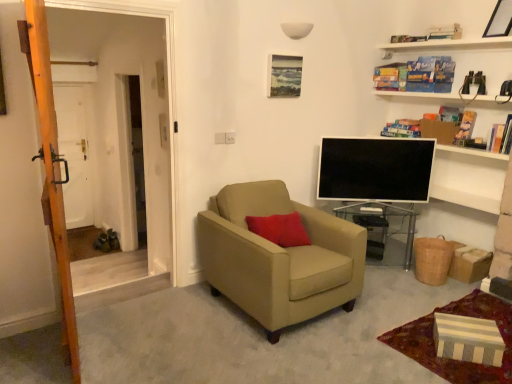
Question: From the image's perspective, is wooden picture frame at upper right, arranged as the second picture frame when ordered from the bottom, on top of wooden ladder at left?

Choices:
 (A) yes
 (B) no

Answer: (A)

Question: Is wooden picture frame at upper right, acting as the 1th picture frame starting from the top, to the right of wooden ladder at left from the viewer's perspective?

Choices:
 (A) no
 (B) yes

Answer: (B)

Question: Is wooden picture frame at upper right, marked as the 1th picture frame in a right-to-left arrangement, next to wooden ladder at left and touching it?

Choices:
 (A) no
 (B) yes

Answer: (A)

Question: From a real-world perspective, is wooden picture frame at upper right, acting as the second picture frame starting from the back, located higher than wooden ladder at left?

Choices:
 (A) no
 (B) yes

Answer: (B)

Question: Is wooden picture frame at upper right, marked as the 1th picture frame in a right-to-left arrangement, further to camera compared to wooden ladder at left?

Choices:
 (A) yes
 (B) no

Answer: (A)

Question: Is hardcover book at upper right, the first book from the bottom, inside the boundaries of transparent glass table at center, or outside?

Choices:
 (A) inside
 (B) outside

Answer: (B)

Question: Considering their positions, is hardcover book at upper right, the first book from the bottom, located in front of or behind transparent glass table at center?

Choices:
 (A) front
 (B) behind

Answer: (A)

Question: Considering the relative positions of hardcover book at upper right, the first book from the bottom, and transparent glass table at center in the image provided, is hardcover book at upper right, the first book from the bottom, to the left or to the right of transparent glass table at center?

Choices:
 (A) left
 (B) right

Answer: (B)

Question: Does point (488, 144) appear closer or farther from the camera than point (385, 206)?

Choices:
 (A) closer
 (B) farther

Answer: (A)

Question: Considering the positions of white matte door at left and hardcover book at upper right, the 3th book positioned from the bottom, in the image, is white matte door at left bigger or smaller than hardcover book at upper right, the 3th book positioned from the bottom,?

Choices:
 (A) small
 (B) big

Answer: (B)

Question: Would you say white matte door at left is to the left or to the right of hardcover book at upper right, the 3th book positioned from the bottom, in the picture?

Choices:
 (A) right
 (B) left

Answer: (B)

Question: Is white matte door at left wider or thinner than hardcover book at upper right, the 3th book positioned from the bottom?

Choices:
 (A) wide
 (B) thin

Answer: (A)

Question: Which is correct: white matte door at left is inside hardcover book at upper right, the 3th book positioned from the bottom, or outside of it?

Choices:
 (A) inside
 (B) outside

Answer: (B)

Question: From the image's perspective, is transparent glass table at center located above or below white glossy tv at center?

Choices:
 (A) below
 (B) above

Answer: (A)

Question: In the image, is transparent glass table at center on the left side or the right side of white glossy tv at center?

Choices:
 (A) right
 (B) left

Answer: (B)